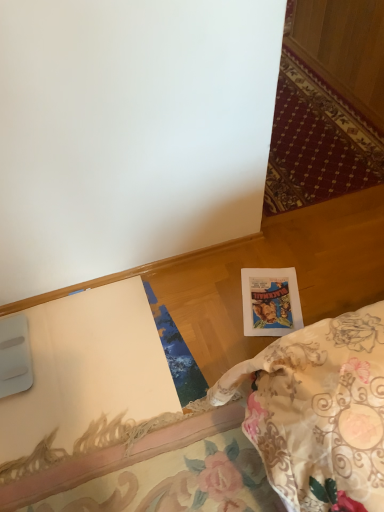
This screenshot has width=384, height=512. I want to click on printed paper postcard at lower right, so click(270, 301).

Measure the distance between point (288, 304) and camera.

Point (288, 304) is 1.54 meters away from camera.

Describe the element at coordinates (270, 301) in the screenshot. This screenshot has width=384, height=512. I see `printed paper postcard at lower right` at that location.

What do you see at coordinates (236, 437) in the screenshot? This screenshot has width=384, height=512. I see `white paper at lower right` at bounding box center [236, 437].

Where is `white paper at lower right`? white paper at lower right is located at coordinates (236, 437).

In order to face white paper at lower right, should I rotate leftwards or rightwards?

To align with it, rotate right about 8.160°.

Locate an element on the screen. printed paper postcard at lower right is located at coordinates (270, 301).

Is white paper at lower right to the right of printed paper postcard at lower right from the viewer's perspective?

No.

Considering the positions of objects white paper at lower right and printed paper postcard at lower right in the image provided, who is in front, white paper at lower right or printed paper postcard at lower right?

white paper at lower right.

Considering the positions of point (189, 467) and point (246, 317), is point (189, 467) closer or farther from the camera than point (246, 317)?

Point (189, 467) is closer to the camera than point (246, 317).

From the image's perspective, is white paper at lower right located above or below printed paper postcard at lower right?

white paper at lower right is situated lower than printed paper postcard at lower right in the image.

From a real-world perspective, does white paper at lower right sit lower than printed paper postcard at lower right?

Incorrect, from a real-world perspective, white paper at lower right is higher than printed paper postcard at lower right.

Is white paper at lower right wider than printed paper postcard at lower right?

Yes, white paper at lower right is wider than printed paper postcard at lower right.

Between white paper at lower right and printed paper postcard at lower right, which one has less height?

Standing shorter between the two is printed paper postcard at lower right.

Which of these two, white paper at lower right or printed paper postcard at lower right, is bigger?

With larger size is white paper at lower right.

Consider the image. Is white paper at lower right positioned beyond the bounds of printed paper postcard at lower right?

Yes, white paper at lower right is not within printed paper postcard at lower right.

Is white paper at lower right touching printed paper postcard at lower right?

white paper at lower right is not next to printed paper postcard at lower right, and they're not touching.

Is white paper at lower right positioned with its back to printed paper postcard at lower right?

Correct, white paper at lower right is looking away from printed paper postcard at lower right.

The width and height of the screenshot is (384, 512). Find the location of `furniture located in front of the printed paper postcard at lower right`. furniture located in front of the printed paper postcard at lower right is located at coordinates (236, 437).

Which object is positioned more to the right, printed paper postcard at lower right or white paper at lower right?

printed paper postcard at lower right is more to the right.

Is printed paper postcard at lower right positioned behind white paper at lower right?

Yes.

Which point is more distant from viewer, (249, 319) or (123, 463)?

Point (249, 319)

From the image's perspective, which is above, printed paper postcard at lower right or white paper at lower right?

From the image's view, printed paper postcard at lower right is above.

From a real-world perspective, relative to white paper at lower right, is printed paper postcard at lower right vertically above or below?

Clearly, from a real-world perspective, printed paper postcard at lower right is below white paper at lower right.

Is printed paper postcard at lower right wider than white paper at lower right?

No.

In the scene shown: Considering the relative sizes of printed paper postcard at lower right and white paper at lower right in the image provided, is printed paper postcard at lower right shorter than white paper at lower right?

Yes, printed paper postcard at lower right is shorter than white paper at lower right.

Is printed paper postcard at lower right smaller than white paper at lower right?

Indeed, printed paper postcard at lower right has a smaller size compared to white paper at lower right.

Would you say printed paper postcard at lower right is inside or outside white paper at lower right?

The correct answer is: inside.

Is printed paper postcard at lower right far away from white paper at lower right?

No, printed paper postcard at lower right is not far away from white paper at lower right.

Based on the photo, could you tell me if printed paper postcard at lower right is facing white paper at lower right?

Yes, printed paper postcard at lower right is facing white paper at lower right.

In order to click on furniture in front of the printed paper postcard at lower right in this screenshot , I will do `click(236, 437)`.

Locate an element on the screen. furniture on the left of printed paper postcard at lower right is located at coordinates (236, 437).

I want to click on postcard on the right of white paper at lower right, so click(270, 301).